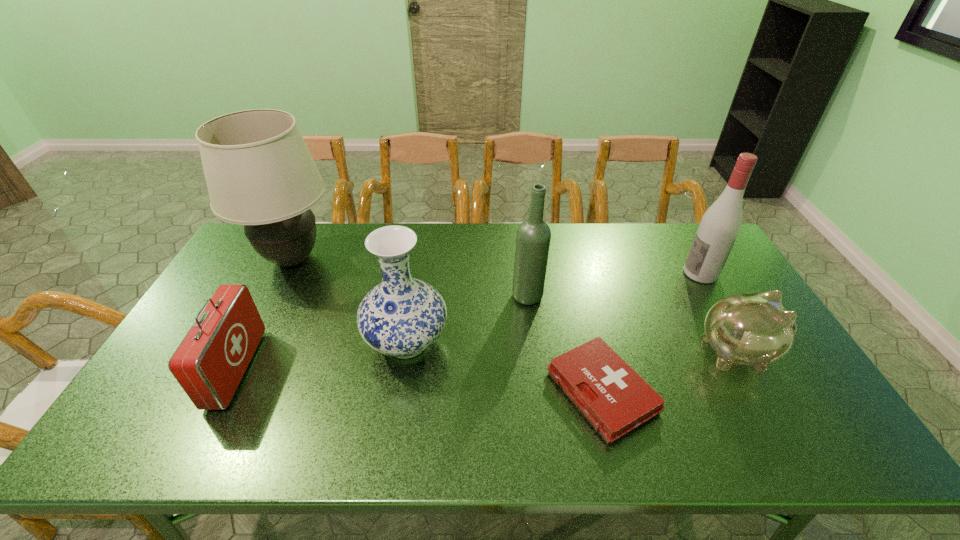
The height and width of the screenshot is (540, 960). Identify the location of vacant space located 0.280m on the label of the alcohol. pyautogui.click(x=598, y=273).

This screenshot has height=540, width=960. In order to click on vacant region located on the label of the alcohol in this screenshot , I will do `click(635, 273)`.

This screenshot has width=960, height=540. I want to click on vacant region located on the label of the alcohol, so click(x=577, y=273).

Locate an element on the screen. vacant area located on the front of the wine bottle is located at coordinates (532, 335).

Where is `free location located on the front of the third object from left to right`? free location located on the front of the third object from left to right is located at coordinates 396,411.

Find the location of a particular element. free spot located on the side of the taller first-aid kit with the first aid cross symbol is located at coordinates (284, 369).

Locate an element on the screen. blank space located 0.380m on the left of the right first-aid kit is located at coordinates (397, 391).

Image resolution: width=960 pixels, height=540 pixels. What are the coordinates of `lampshade that is positioned at the far edge` in the screenshot? It's located at (259, 171).

I want to click on alcohol present at the far edge, so click(720, 225).

Identify the location of object that is at the near edge. This screenshot has height=540, width=960. (615, 399).